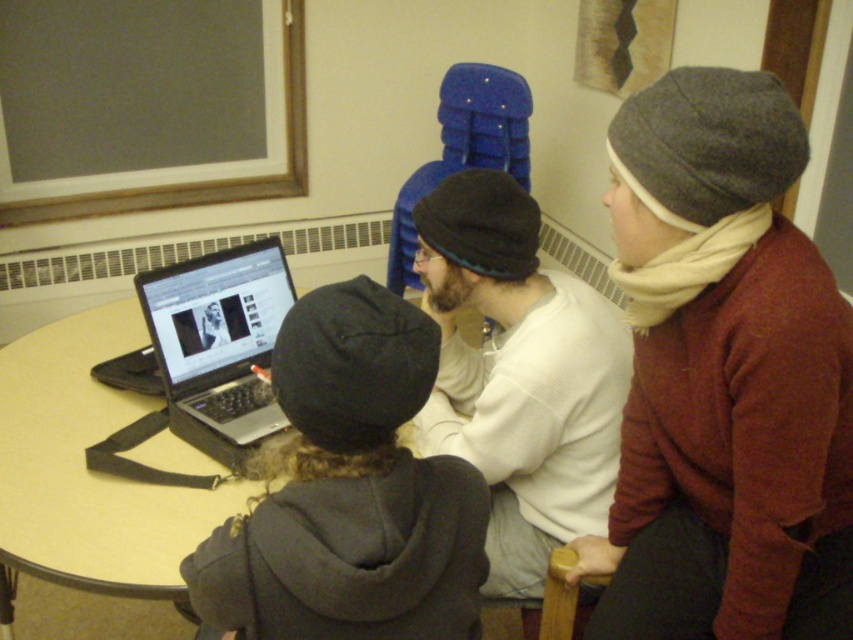
Question: Can you confirm if gray woolen beanie at upper right is positioned above white cotton shirt at center?

Choices:
 (A) yes
 (B) no

Answer: (B)

Question: Which point is farther to the camera?

Choices:
 (A) white cotton shirt at center
 (B) black matte laptop at center
 (C) dark gray knit beanie at center
 (D) gray woolen beanie at upper right

Answer: (B)

Question: Which of the following is the closest to the observer?

Choices:
 (A) gray woolen beanie at upper right
 (B) white cotton shirt at center
 (C) black matte laptop at center

Answer: (A)

Question: Is gray woolen beanie at upper right positioned behind dark gray knit beanie at center?

Choices:
 (A) yes
 (B) no

Answer: (A)

Question: Which object is the farthest from the black matte laptop at center?

Choices:
 (A) white cotton shirt at center
 (B) dark gray knit beanie at center

Answer: (B)

Question: Does gray woolen beanie at upper right come behind dark gray knit beanie at center?

Choices:
 (A) no
 (B) yes

Answer: (B)